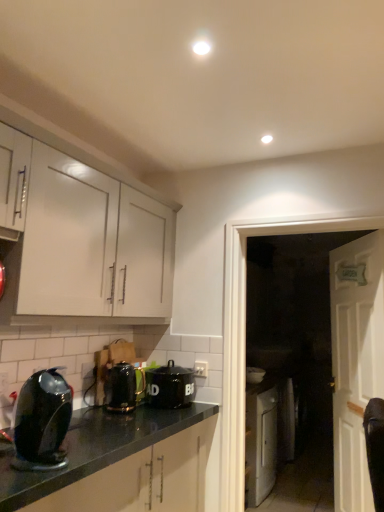
Question: Would you say white wooden door at right is outside metallic black kettle at lower center, positioned as the second kitchen appliance in right-to-left order?

Choices:
 (A) yes
 (B) no

Answer: (A)

Question: Is white wooden door at right at the left side of metallic black kettle at lower center, the second kitchen appliance when ordered from back to front?

Choices:
 (A) no
 (B) yes

Answer: (A)

Question: Is white wooden door at right further to camera compared to metallic black kettle at lower center, the second kitchen appliance viewed from the left?

Choices:
 (A) yes
 (B) no

Answer: (B)

Question: Considering the relative sizes of white wooden door at right and metallic black kettle at lower center, positioned as the second kitchen appliance in right-to-left order, in the image provided, is white wooden door at right smaller than metallic black kettle at lower center, positioned as the second kitchen appliance in right-to-left order,?

Choices:
 (A) yes
 (B) no

Answer: (B)

Question: Is white wooden door at right closer to camera compared to metallic black kettle at lower center, positioned as the second kitchen appliance in right-to-left order?

Choices:
 (A) yes
 (B) no

Answer: (A)

Question: Is white wooden door at right thinner than metallic black kettle at lower center, arranged as the 2th kitchen appliance when viewed from the front?

Choices:
 (A) no
 (B) yes

Answer: (B)

Question: Considering the relative sizes of white wooden door at right and black ceramic canister at center, acting as the 1th kitchen appliance starting from the right, in the image provided, is white wooden door at right bigger than black ceramic canister at center, acting as the 1th kitchen appliance starting from the right,?

Choices:
 (A) no
 (B) yes

Answer: (B)

Question: From a real-world perspective, does white wooden door at right stand above black ceramic canister at center, acting as the 1th kitchen appliance starting from the right?

Choices:
 (A) no
 (B) yes

Answer: (A)

Question: Is white wooden door at right placed right next to black ceramic canister at center, placed as the 3th kitchen appliance when sorted from left to right?

Choices:
 (A) yes
 (B) no

Answer: (B)

Question: Is white wooden door at right closer to camera compared to black ceramic canister at center, the 3th kitchen appliance positioned from the front?

Choices:
 (A) no
 (B) yes

Answer: (B)

Question: Considering the relative sizes of white wooden door at right and black ceramic canister at center, placed as the 3th kitchen appliance when sorted from left to right, in the image provided, is white wooden door at right shorter than black ceramic canister at center, placed as the 3th kitchen appliance when sorted from left to right,?

Choices:
 (A) yes
 (B) no

Answer: (B)

Question: Is white wooden door at right wider than black ceramic canister at center, the first kitchen appliance viewed from the back?

Choices:
 (A) no
 (B) yes

Answer: (A)

Question: Does white wooden door at right have a greater width compared to white glossy cabinet at upper left?

Choices:
 (A) yes
 (B) no

Answer: (B)